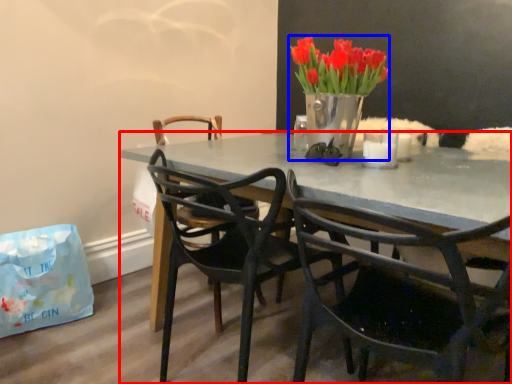
Question: Which point is closer to the camera, desk (highlighted by a red box) or houseplant (highlighted by a blue box)?

Choices:
 (A) desk
 (B) houseplant

Answer: (A)